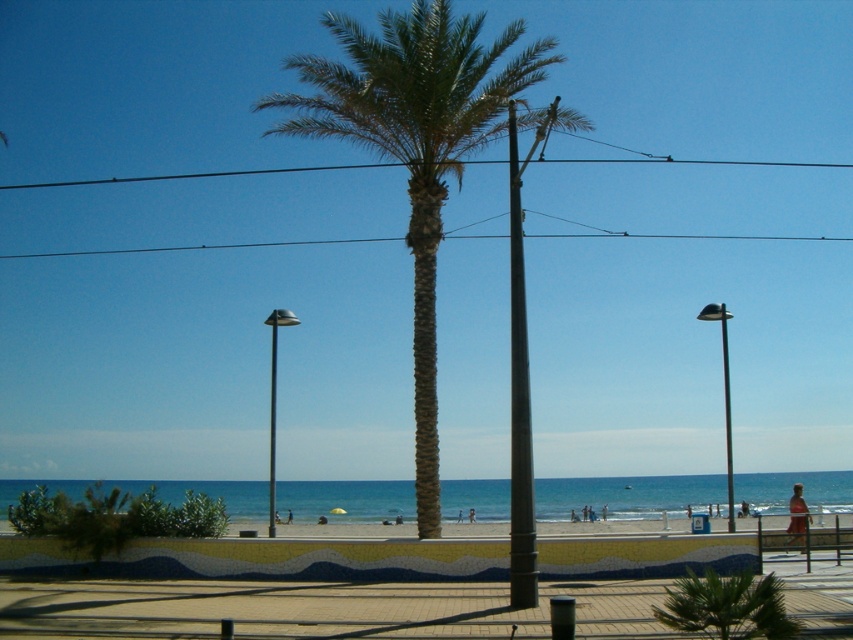
You are a photographer standing at the beach center. You want to take a photo of the tan skin person at beach center without the green leafy palm tree at center blocking the view. Is the palm tree currently blocking the person?

The green leafy palm tree at center is above the tan skin person at beach center, so it is blocking the view of the person.